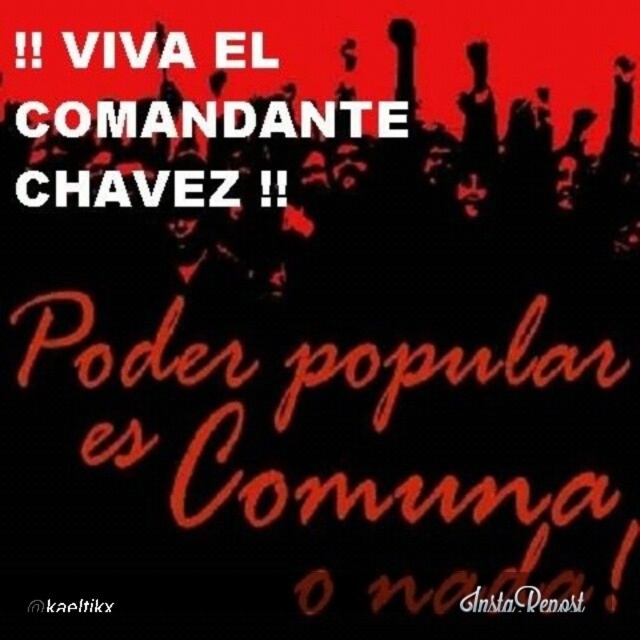
You are a graphic designer reviewing a poster for a client. The client wants to ensure that the black instarepost at upper center and the black text at upper center are arranged in a way that the taller element is placed above the shorter one. Based on the provided image, does the current layout meet the client requirement?

The black instarepost at upper center is taller than the black text at upper center. Since the taller element is already placed above the shorter one, the current layout meets the client requirement.

You are designing a poster and need to place a new element. The existing white text at upper left is positioned at coordinates point 0.077, 0.202. If you want to place a new element to the right of this text, what coordinate x value should be greater than 0.077?

The new element should have an x coordinate greater than 0.077 to be placed to the right of the white text at upper left located at point (x=129, y=49).

Based on the photo, you are a graphic designer reviewing the political poster described. You notice an object at point [524,600]. What is the object located at that coordinate?

The object at point [524,600] is the black instarepost at upper center.